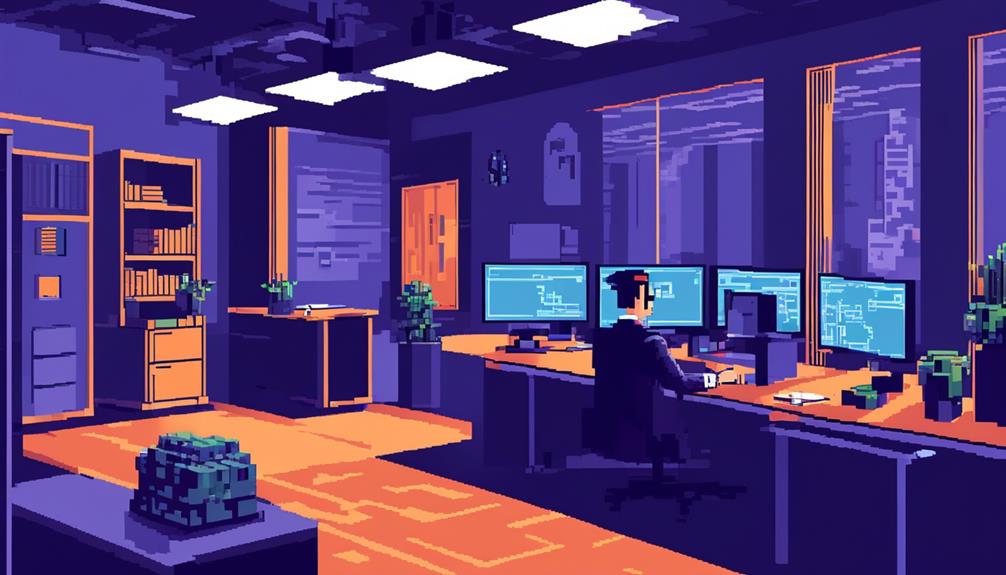
Where is `floor`? floor is located at coordinates (99, 447), (249, 413), (412, 419), (397, 540), (567, 557).